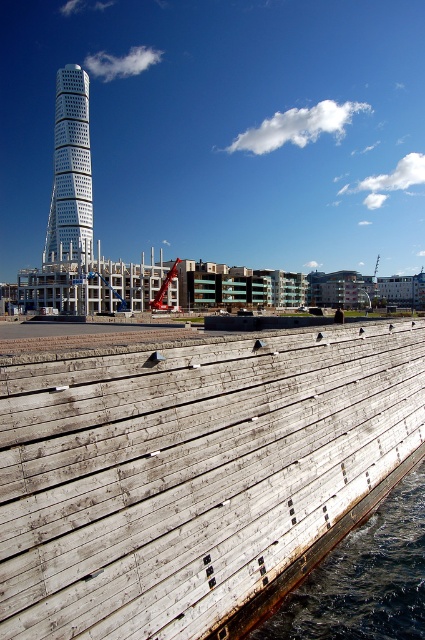
You are standing at point (x=192, y=472) in the waterfront scene. What object are you standing on?

You are standing on the weathered wood dock at lower left located at point (x=192, y=472).

You are standing at the base of the cylindrical building and want to walk to the wooden retaining wall. Which point, point (368, 500) or point (84, 188), is closer to your starting position?

Point (368, 500) is closer to your starting position because it is in front of point (84, 188).

You are an architect evaluating the waterfront site. You see the dark blue water at lower right and the white glass tower at upper left. Which of these two elements takes up more visual space in the image?

The white glass tower at upper left occupies more visual space than the dark blue water at lower right according to the description.